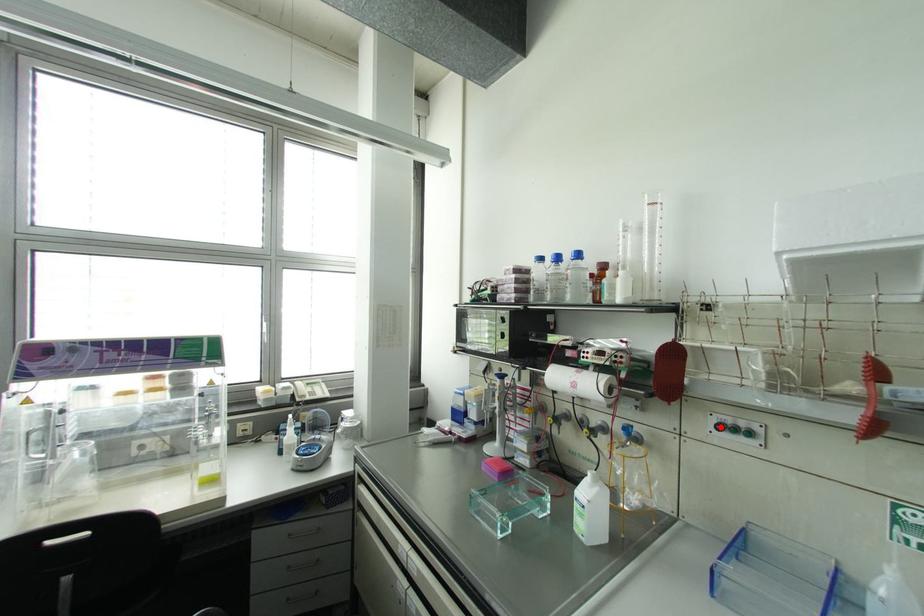
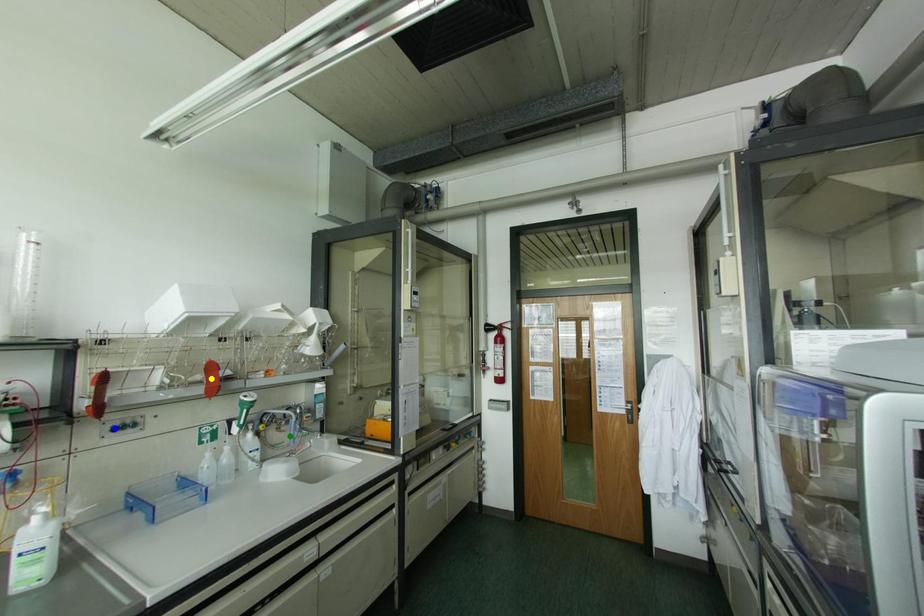
Question: I am providing you with two images of the same scene from different viewpoints. A red point is marked on the first image. You are given multiple points on the second image. In image 2, which mark is for the same physical point as the one in image 1?

Choices:
 (A) green point
 (B) yellow point
 (C) blue point

Answer: (C)